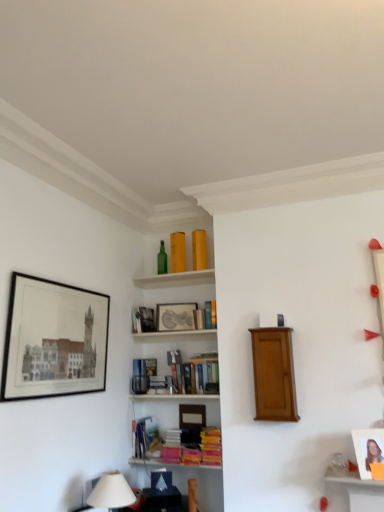
Question: Is green glass bottle at upper center further to the viewer compared to white fabric lampshade at lower left?

Choices:
 (A) no
 (B) yes

Answer: (B)

Question: Is green glass bottle at upper center smaller than white fabric lampshade at lower left?

Choices:
 (A) yes
 (B) no

Answer: (A)

Question: Does green glass bottle at upper center have a greater height compared to white fabric lampshade at lower left?

Choices:
 (A) yes
 (B) no

Answer: (A)

Question: Can you confirm if green glass bottle at upper center is positioned to the left of white fabric lampshade at lower left?

Choices:
 (A) yes
 (B) no

Answer: (B)

Question: Does green glass bottle at upper center have a greater width compared to white fabric lampshade at lower left?

Choices:
 (A) no
 (B) yes

Answer: (A)

Question: Can you confirm if green glass bottle at upper center is thinner than white fabric lampshade at lower left?

Choices:
 (A) yes
 (B) no

Answer: (A)

Question: From a real-world perspective, is mahogany wood cabinet at center under matte glass bottles at upper center?

Choices:
 (A) yes
 (B) no

Answer: (A)

Question: Does mahogany wood cabinet at center have a greater width compared to matte glass bottles at upper center?

Choices:
 (A) no
 (B) yes

Answer: (A)

Question: Considering the relative sizes of mahogany wood cabinet at center and matte glass bottles at upper center in the image provided, is mahogany wood cabinet at center thinner than matte glass bottles at upper center?

Choices:
 (A) no
 (B) yes

Answer: (B)

Question: From the image's perspective, would you say mahogany wood cabinet at center is positioned over matte glass bottles at upper center?

Choices:
 (A) no
 (B) yes

Answer: (A)

Question: Is mahogany wood cabinet at center closer to the viewer compared to matte glass bottles at upper center?

Choices:
 (A) no
 (B) yes

Answer: (B)

Question: Is mahogany wood cabinet at center at the right side of matte glass bottles at upper center?

Choices:
 (A) yes
 (B) no

Answer: (A)

Question: Considering the relative sizes of hardcover book at upper center, arranged as the 1th book when viewed from the top, and hardcover book at center, the 3th book positioned from the bottom, in the image provided, is hardcover book at upper center, arranged as the 1th book when viewed from the top, shorter than hardcover book at center, the 3th book positioned from the bottom,?

Choices:
 (A) yes
 (B) no

Answer: (A)